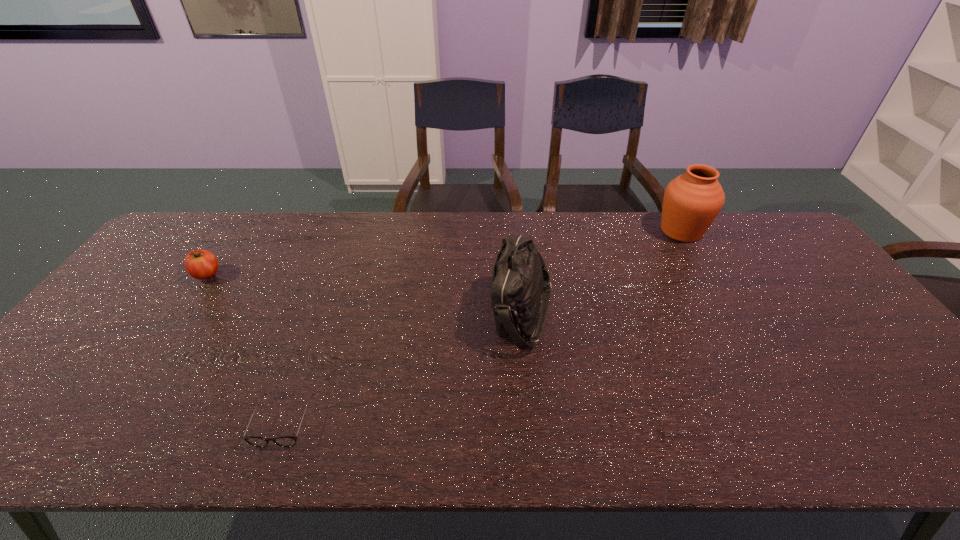
This screenshot has height=540, width=960. In order to click on the farthest object in this screenshot , I will do `click(692, 201)`.

Where is `the rightmost object`? The width and height of the screenshot is (960, 540). the rightmost object is located at coordinates (692, 201).

This screenshot has width=960, height=540. What are the coordinates of `the second object from right to left` in the screenshot? It's located at (520, 275).

Identify the location of the leftmost object. (200, 264).

This screenshot has width=960, height=540. What are the coordinates of `the second shortest object` in the screenshot? It's located at (200, 264).

Find the location of a particular element. The height and width of the screenshot is (540, 960). spectacles is located at coordinates (284, 441).

Locate an element on the screen. the shortest object is located at coordinates (284, 441).

Locate an element on the screen. This screenshot has width=960, height=540. blank area located 0.130m on the left of the rightmost object is located at coordinates (616, 231).

Find the location of a particular element. vacant space located at the front padded panel of the third object from left to right is located at coordinates (431, 313).

This screenshot has width=960, height=540. What are the coordinates of `free space located 0.120m at the front padded panel of the third object from left to right` in the screenshot? It's located at (446, 313).